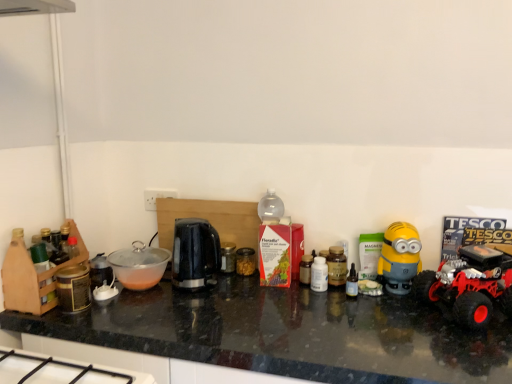
Where is `vacant space to the right of translucent plastic bottle at center, placed as the fourth bottle when sorted from left to right`? The image size is (512, 384). vacant space to the right of translucent plastic bottle at center, placed as the fourth bottle when sorted from left to right is located at coordinates (397, 306).